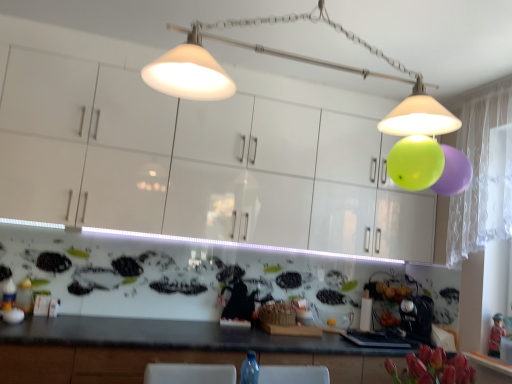
You are a GUI agent. You are given a task and a screenshot of the screen. Output one action in this format:
    pyautogui.click(x=<x>, y=<y>)
    Task: Click on the wooden figurine at lower right
    The height and width of the screenshot is (384, 512).
    Given the screenshot: What is the action you would take?
    pyautogui.click(x=496, y=335)

Identify the location of matte white lampshade at upper center. The image size is (512, 384). (294, 60).

Considering the relative positions of white glossy cabinets at upper center and matte white lampshade at upper center in the image provided, is white glossy cabinets at upper center to the left or to the right of matte white lampshade at upper center?

In the image, white glossy cabinets at upper center appears on the left side of matte white lampshade at upper center.

Is white glossy cabinets at upper center far away from matte white lampshade at upper center?

No, white glossy cabinets at upper center is in close proximity to matte white lampshade at upper center.

Consider the image. From the image's perspective, would you say white glossy cabinets at upper center is shown under matte white lampshade at upper center?

Indeed, from the image's perspective, white glossy cabinets at upper center is shown beneath matte white lampshade at upper center.

Could you tell me if white glossy cabinets at upper center is facing matte white lampshade at upper center?

Yes.

In terms of width, does wooden figurine at lower right look wider or thinner when compared to white glossy cabinets at upper center?

wooden figurine at lower right is thinner than white glossy cabinets at upper center.

The image size is (512, 384). There is a wooden figurine at lower right. Find the location of `cabinetry above it (from a real-world perspective)`. cabinetry above it (from a real-world perspective) is located at coordinates (198, 164).

Between wooden figurine at lower right and white glossy cabinets at upper center, which one is positioned behind?

wooden figurine at lower right is further away from the camera.

Between wooden figurine at lower right and white glossy cabinets at upper center, which one appears on the right side from the viewer's perspective?

wooden figurine at lower right.

The height and width of the screenshot is (384, 512). Find the location of `toy lying on the right of matte white lampshade at upper center`. toy lying on the right of matte white lampshade at upper center is located at coordinates (496, 335).

Considering the positions of point (205, 37) and point (498, 329), is point (205, 37) closer or farther from the camera than point (498, 329)?

Point (205, 37) is farther from the camera than point (498, 329).

Looking at this image, is matte white lampshade at upper center to the left of wooden figurine at lower right from the viewer's perspective?

Yes, matte white lampshade at upper center is to the left of wooden figurine at lower right.

From the image's perspective, is matte white lampshade at upper center on top of wooden figurine at lower right?

Correct, matte white lampshade at upper center appears higher than wooden figurine at lower right in the image.

Would you say matte white lampshade at upper center is part of wooden figurine at lower right's contents?

No, matte white lampshade at upper center is not inside wooden figurine at lower right.

Between wooden figurine at lower right and matte white lampshade at upper center, which one has larger width?

matte white lampshade at upper center is wider.

In the scene shown: Is wooden figurine at lower right looking in the opposite direction of matte white lampshade at upper center?

No.

From a real-world perspective, which is physically below, wooden figurine at lower right or matte white lampshade at upper center?

From a 3D spatial view, wooden figurine at lower right is below.

Can you see matte white lampshade at upper center touching white glossy cabinets at upper center?

matte white lampshade at upper center is not next to white glossy cabinets at upper center, and they're not touching.

What's the angular difference between matte white lampshade at upper center and white glossy cabinets at upper center's facing directions?

9.63e-05 degrees separate the facing orientations of matte white lampshade at upper center and white glossy cabinets at upper center.

Is matte white lampshade at upper center oriented away from white glossy cabinets at upper center?

Yes, matte white lampshade at upper center is positioned with its back facing white glossy cabinets at upper center.

Is matte white lampshade at upper center bigger than white glossy cabinets at upper center?

No.

Where is `cabinetry above the wooden figurine at lower right (from a real-world perspective)`? cabinetry above the wooden figurine at lower right (from a real-world perspective) is located at coordinates (198, 164).

Visually, is white glossy cabinets at upper center positioned to the left or to the right of wooden figurine at lower right?

Clearly, white glossy cabinets at upper center is on the left of wooden figurine at lower right in the image.

Is white glossy cabinets at upper center in front of wooden figurine at lower right?

Yes, the depth of white glossy cabinets at upper center is less than that of wooden figurine at lower right.

From a real-world perspective, is white glossy cabinets at upper center physically above wooden figurine at lower right?

Yes, from a real-world perspective, white glossy cabinets at upper center is above wooden figurine at lower right.

The height and width of the screenshot is (384, 512). Identify the location of lamp on the right of white glossy cabinets at upper center. click(294, 60).

This screenshot has width=512, height=384. Identify the location of cabinetry located in front of the wooden figurine at lower right. click(x=198, y=164).

From the image, which object appears to be nearer to wooden figurine at lower right, white glossy cabinets at upper center or matte white lampshade at upper center?

white glossy cabinets at upper center lies closer to wooden figurine at lower right than the other object.

When comparing their distances from wooden figurine at lower right, does matte white lampshade at upper center or white glossy cabinets at upper center seem closer?

white glossy cabinets at upper center lies closer to wooden figurine at lower right than the other object.

Based on the photo, considering their positions, is matte white lampshade at upper center positioned further to white glossy cabinets at upper center than wooden figurine at lower right?

wooden figurine at lower right is further to white glossy cabinets at upper center.

Looking at the image, which one is located closer to matte white lampshade at upper center, white glossy cabinets at upper center or wooden figurine at lower right?

Among the two, white glossy cabinets at upper center is located nearer to matte white lampshade at upper center.

Based on their spatial positions, is wooden figurine at lower right or white glossy cabinets at upper center closer to matte white lampshade at upper center?

white glossy cabinets at upper center is closer to matte white lampshade at upper center.

Estimate the real-world distances between objects in this image. Which object is closer to white glossy cabinets at upper center, wooden figurine at lower right or matte white lampshade at upper center?

Among the two, matte white lampshade at upper center is located nearer to white glossy cabinets at upper center.

You are a GUI agent. You are given a task and a screenshot of the screen. Output one action in this format:
    pyautogui.click(x=<x>, y=<y>)
    Task: Click on the lamp between white glossy cabinets at upper center and wooden figurine at lower right
    This screenshot has height=384, width=512.
    Given the screenshot: What is the action you would take?
    pyautogui.click(x=294, y=60)